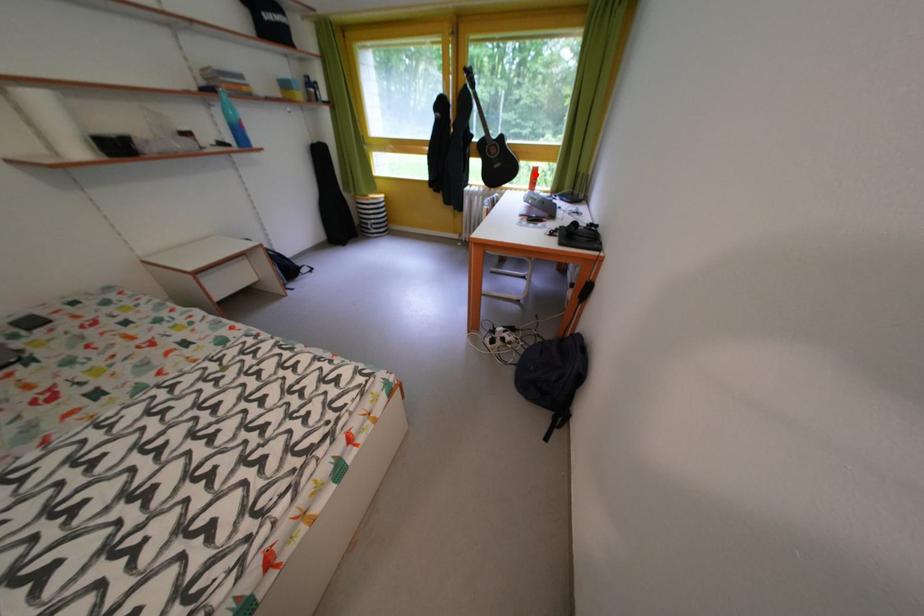
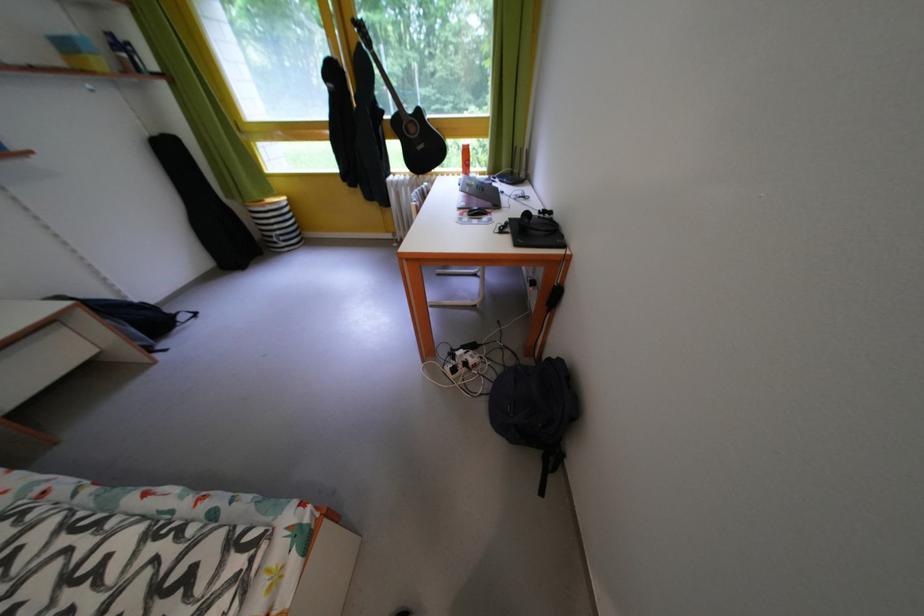
In the second image, find the point that corresponds to the highlighted location in the first image.

(465, 153)